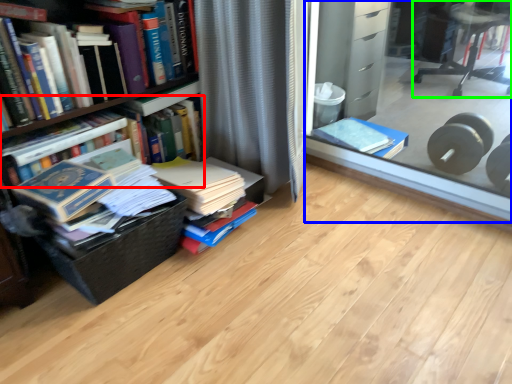
Question: Which object is the closest to the book (highlighted by a red box)? Choose among these: glass box (highlighted by a blue box) or chair (highlighted by a green box).

Choices:
 (A) glass box
 (B) chair

Answer: (A)